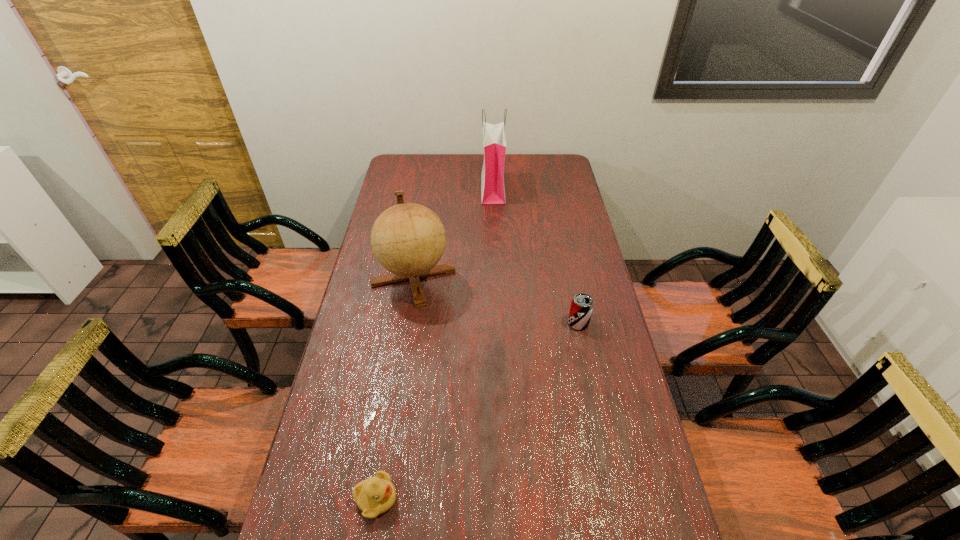
Identify the location of the second closest object to the globe. (581, 308).

Locate an element on the screen. This screenshot has height=540, width=960. object that is the second closest to the third tallest object is located at coordinates (494, 138).

Where is `vacant space that satisfies the following two spatial constraints: 1. on the front side of the second shortest object; 2. on the front-facing side of the shortest object`? This screenshot has width=960, height=540. vacant space that satisfies the following two spatial constraints: 1. on the front side of the second shortest object; 2. on the front-facing side of the shortest object is located at coordinates (614, 498).

The image size is (960, 540). I want to click on free point that satisfies the following two spatial constraints: 1. on the front-facing side of the second object from right to left; 2. on the right side of the third tallest object, so click(x=498, y=323).

Find the location of a particular element. The image size is (960, 540). vacant space that satisfies the following two spatial constraints: 1. on the surface of the globe; 2. on the right side of the rightmost object is located at coordinates (406, 323).

Identify the location of free space in the image that satisfies the following two spatial constraints: 1. on the surface of the globe; 2. on the front-facing side of the shortest object. (378, 498).

Locate an element on the screen. Image resolution: width=960 pixels, height=540 pixels. vacant space that satisfies the following two spatial constraints: 1. on the back side of the rightmost object; 2. on the front-facing side of the shopping bag is located at coordinates (550, 189).

This screenshot has width=960, height=540. What are the coordinates of `vacant region that satisfies the following two spatial constraints: 1. on the front-facing side of the third object from left to right; 2. on the surface of the second farthest object` in the screenshot? It's located at (496, 276).